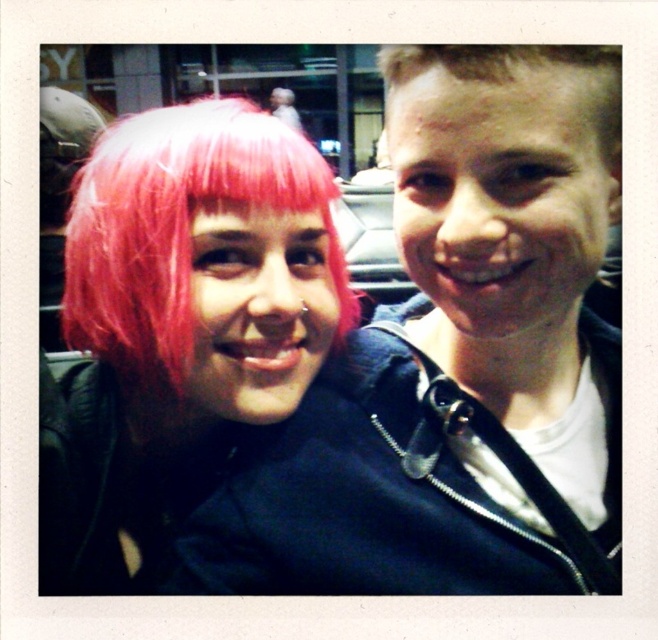
Does pink matte hair at center appear on the left side of pink matte wig at left?

No, pink matte hair at center is not to the left of pink matte wig at left.

From the picture: Who is more forward, [557,385] or [330,296]?

Positioned in front is point [330,296].

Identify the location of pink matte hair at center. Image resolution: width=658 pixels, height=640 pixels. [459, 358].

Does pink matte hair at center have a larger size compared to blonde hair at upper right?

Yes.

Between point (497, 534) and point (619, 45), which one is positioned behind?

Positioned behind is point (497, 534).

The height and width of the screenshot is (640, 658). Identify the location of pink matte hair at center. (459, 358).

Is pink matte wig at left above blonde hair at upper right?

No.

Measure the distance from pink matte wig at left to blonde hair at upper right.

pink matte wig at left is 11.06 inches from blonde hair at upper right.

Identify the location of pink matte wig at left. (180, 316).